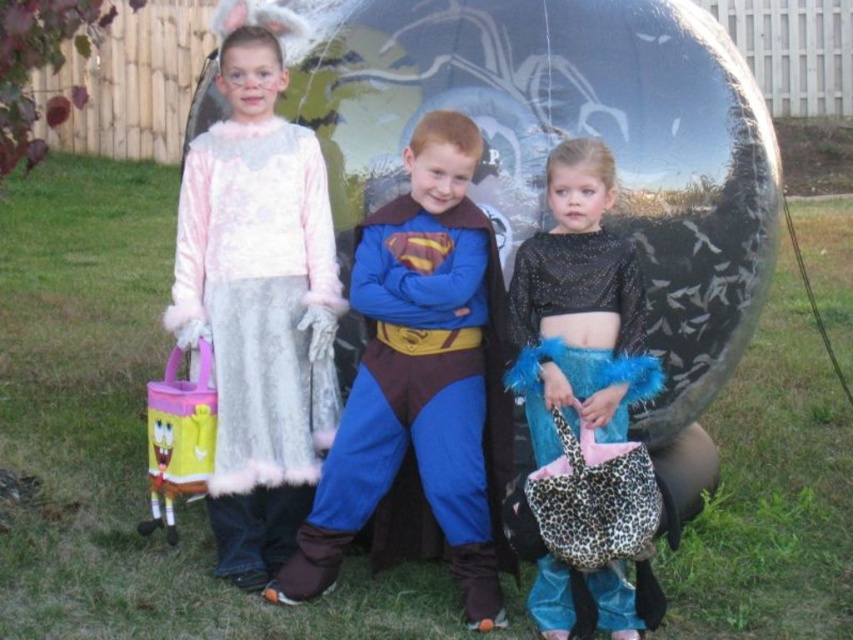
Question: Which point appears closest to the camera in this image?

Choices:
 (A) (379, 234)
 (B) (585, 92)

Answer: (A)

Question: Does glossy black sphere at center appear under fuzzy white dress at center?

Choices:
 (A) no
 (B) yes

Answer: (A)

Question: Is blue fabric superman costume at center above sparkly black top at center?

Choices:
 (A) no
 (B) yes

Answer: (B)

Question: Which point is closer to the camera?

Choices:
 (A) blue fabric superman costume at center
 (B) fuzzy white dress at center
 (C) sparkly black top at center
 (D) glossy black sphere at center

Answer: (C)

Question: Which of the following is the farthest from the observer?

Choices:
 (A) (311, 561)
 (B) (202, 243)
 (C) (708, 205)

Answer: (C)

Question: Is blue fabric superman costume at center smaller than sparkly black top at center?

Choices:
 (A) yes
 (B) no

Answer: (B)